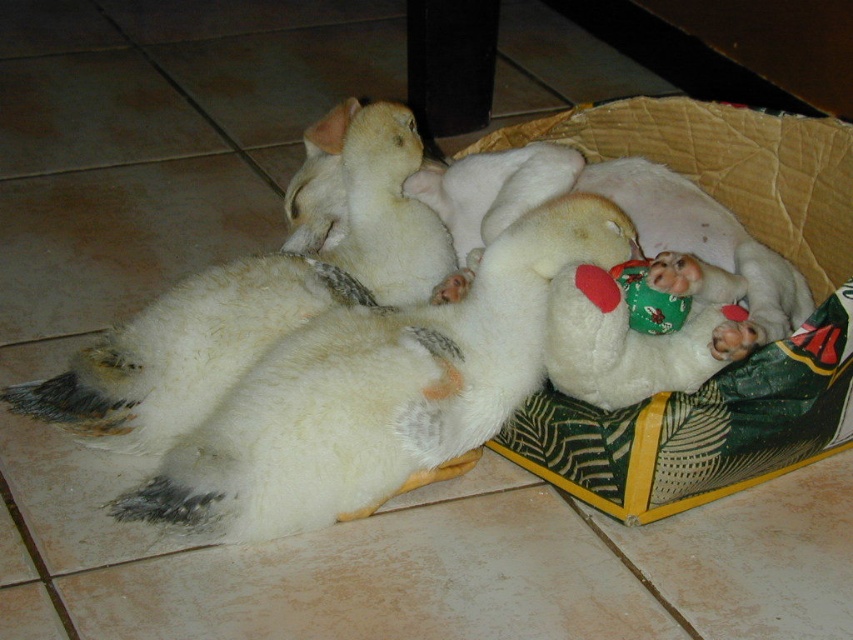
Question: Which of these objects is positioned farthest from the white fluffy dog at center?

Choices:
 (A) cardboard basket at center
 (B) white plush bear at center

Answer: (A)

Question: Which point is closer to the camera?

Choices:
 (A) (749, 436)
 (B) (291, 333)

Answer: (A)

Question: Which object is the farthest from the white fluffy dog at center?

Choices:
 (A) cardboard basket at center
 (B) white plush bear at center

Answer: (A)

Question: Is cardboard basket at center to the right of white plush bear at center from the viewer's perspective?

Choices:
 (A) no
 (B) yes

Answer: (B)

Question: Does cardboard basket at center appear over white plush bear at center?

Choices:
 (A) yes
 (B) no

Answer: (B)

Question: Is cardboard basket at center smaller than white plush bear at center?

Choices:
 (A) no
 (B) yes

Answer: (A)